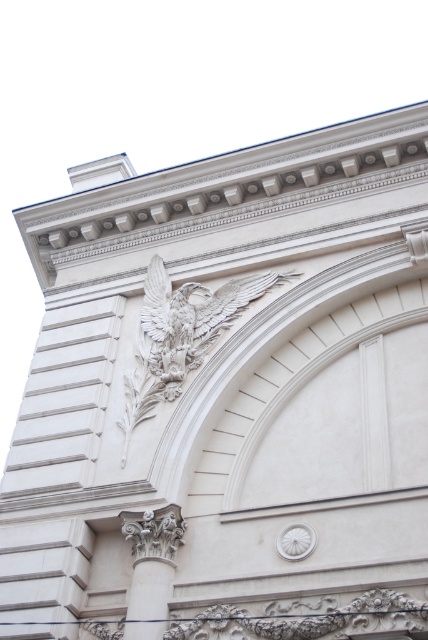
You are an architect analyzing the classical facade. You notice two points marked on the image at coordinates point (x=151, y=317) and point (x=124, y=518). Which point is closer to the viewer?

Point (x=124, y=518) is closer to the viewer because it is in front of point (x=151, y=317).

You are an architect examining the classical facade. You notice the white stone eagle at upper center and the white stone column at center. Which object is closer to your viewpoint?

The white stone eagle at upper center is closer to the viewpoint because it is positioned further to the viewer than the white stone column at center.